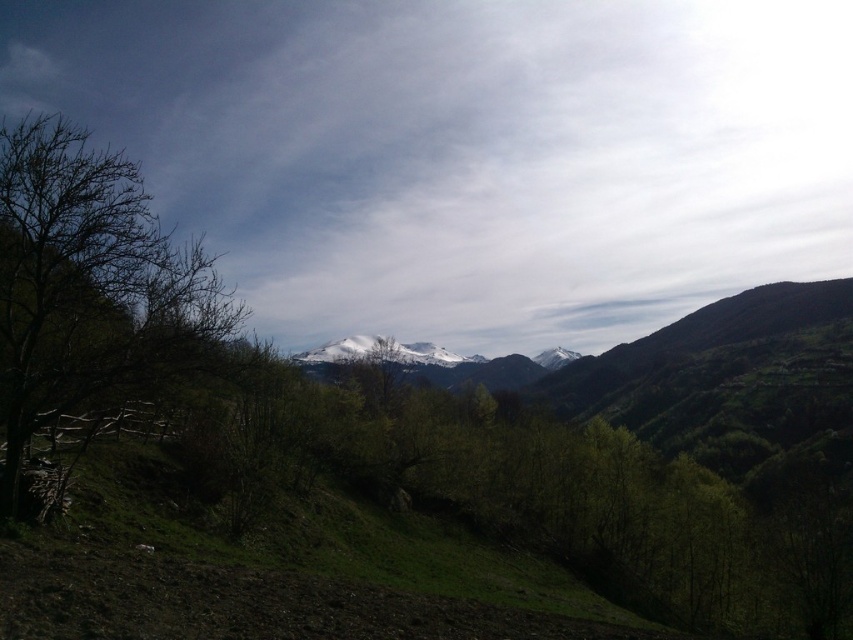
Question: Does bare branches at left have a lesser width compared to white snow-covered mountain range at center?

Choices:
 (A) no
 (B) yes

Answer: (A)

Question: Does bare branches at left have a smaller size compared to white snow-covered mountain range at center?

Choices:
 (A) yes
 (B) no

Answer: (B)

Question: Estimate the real-world distances between objects in this image. Which object is farther from the bare branches at left?

Choices:
 (A) white snow-covered mountain range at center
 (B) white fluffy cloud at upper center

Answer: (B)

Question: Among these objects, which one is farthest from the camera?

Choices:
 (A) bare branches at left
 (B) white fluffy cloud at upper center
 (C) white snow-covered mountain range at center

Answer: (C)

Question: Can you confirm if bare branches at left is positioned above white snow-covered mountain range at center?

Choices:
 (A) no
 (B) yes

Answer: (B)

Question: Which of the following is the closest to the observer?

Choices:
 (A) (131, 232)
 (B) (451, 371)
 (C) (194, 56)

Answer: (A)